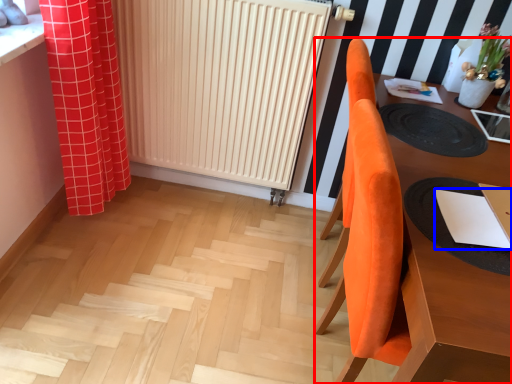
Question: Which point is closer to the camera, furniture (highlighted by a red box) or notepad (highlighted by a blue box)?

Choices:
 (A) furniture
 (B) notepad

Answer: (A)